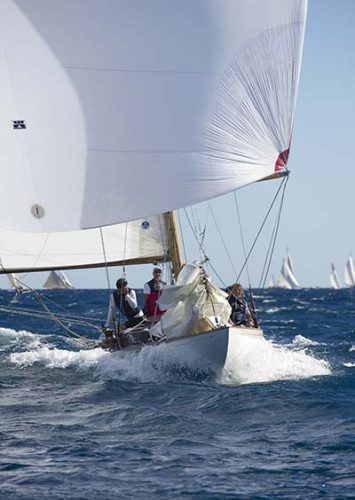
This screenshot has height=500, width=355. Find the location of `cables`. cables is located at coordinates (58, 320).